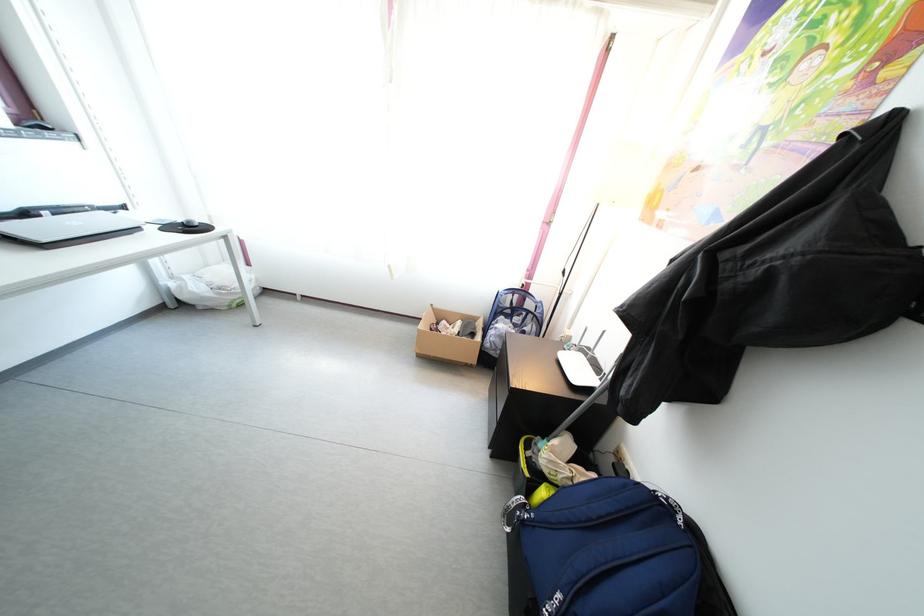
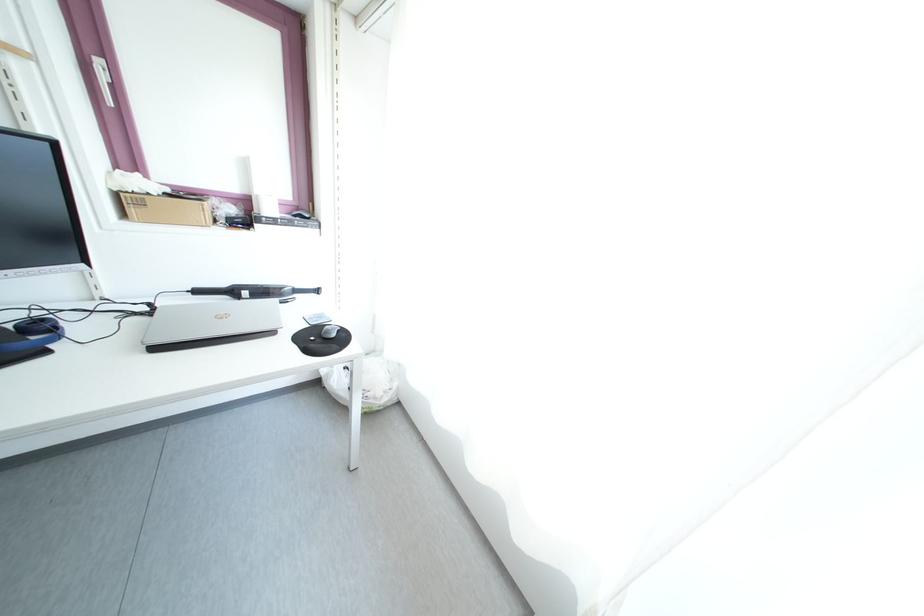
Where in the second image is the point corresponding to point 210,306 from the first image?

(344, 403)